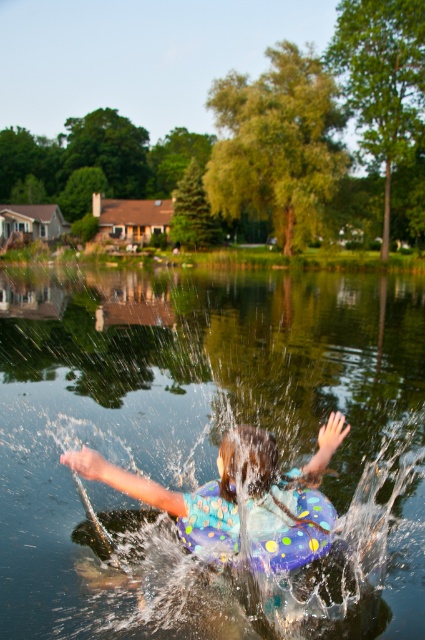
Which of these two, polka dot floaty at center or polka dot rubber life jacket at center, stands taller?

With more height is polka dot floaty at center.

Does polka dot floaty at center have a lesser height compared to polka dot rubber life jacket at center?

No.

Is point (221, 481) closer to viewer compared to point (300, 561)?

No, (221, 481) is behind (300, 561).

I want to click on polka dot floaty at center, so click(241, 499).

Between clear water at center and polka dot rubber life jacket at center, which one is positioned higher?

clear water at center

Is clear water at center further to the viewer compared to polka dot rubber life jacket at center?

Yes.

This screenshot has height=640, width=425. In order to click on clear water at center in this screenshot , I will do `click(206, 445)`.

Does clear water at center have a smaller size compared to polka dot floaty at center?

Incorrect, clear water at center is not smaller in size than polka dot floaty at center.

Does clear water at center come behind polka dot floaty at center?

Yes, clear water at center is further from the viewer.

What do you see at coordinates (206, 445) in the screenshot? This screenshot has width=425, height=640. I see `clear water at center` at bounding box center [206, 445].

Find the location of a particular element. The width and height of the screenshot is (425, 640). clear water at center is located at coordinates (206, 445).